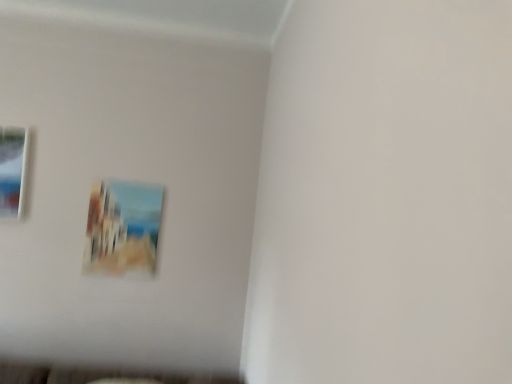
Describe the element at coordinates (122, 228) in the screenshot. The width and height of the screenshot is (512, 384). I see `matte wooden picture frame at center` at that location.

Find the location of a particular element. matte wooden picture frame at center is located at coordinates (122, 228).

Where is `matte wooden picture frame at center`? This screenshot has height=384, width=512. matte wooden picture frame at center is located at coordinates (122, 228).